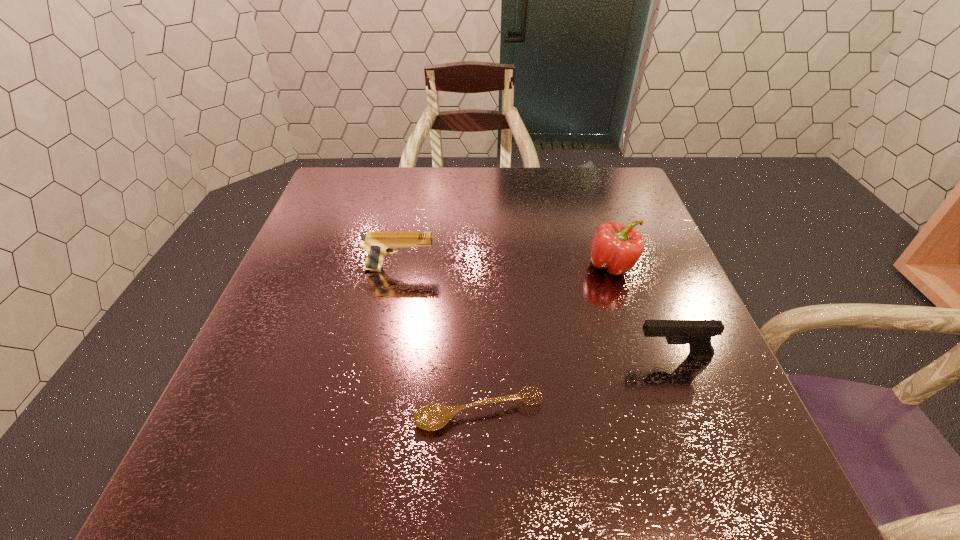
What are the coordinates of `vacant space at the far right corner of the desktop` in the screenshot? It's located at (610, 212).

The height and width of the screenshot is (540, 960). I want to click on free space at the near right corner, so click(x=694, y=477).

At what (x,y) coordinates should I click in order to perform the action: click on vacant area that lies between the pepper and the farther pistol. Please return your answer as a coordinate pair (x, y). Image resolution: width=960 pixels, height=540 pixels. Looking at the image, I should click on (506, 267).

You are a GUI agent. You are given a task and a screenshot of the screen. Output one action in this format:
    pyautogui.click(x=<x>, y=<y>)
    Task: Click on the free space between the nearest object and the right pistol
    This screenshot has height=540, width=960.
    Given the screenshot: What is the action you would take?
    pyautogui.click(x=575, y=384)

Where is `unoccupied area between the pepper and the nearest object`? unoccupied area between the pepper and the nearest object is located at coordinates pyautogui.click(x=545, y=339).

Where is `blank region between the pepper and the farther pistol`? Image resolution: width=960 pixels, height=540 pixels. blank region between the pepper and the farther pistol is located at coordinates (506, 267).

Image resolution: width=960 pixels, height=540 pixels. What are the coordinates of `free point between the shortest object and the pepper` in the screenshot? It's located at (545, 339).

At what (x,y) coordinates should I click in order to perform the action: click on vacant area that lies between the pepper and the shortest object. Please return your answer as a coordinate pair (x, y). Image resolution: width=960 pixels, height=540 pixels. Looking at the image, I should click on (545, 339).

Locate an element on the screen. free space between the left pistol and the nearest object is located at coordinates (440, 341).

At what (x,y) coordinates should I click in order to perform the action: click on blank region between the pepper and the right pistol. Please return your answer as a coordinate pair (x, y). The image size is (960, 540). Looking at the image, I should click on (642, 310).